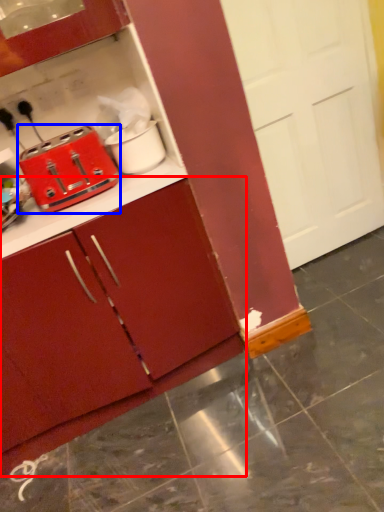
Question: Which object is closer to the camera taking this photo, cabinetry (highlighted by a red box) or toaster (highlighted by a blue box)?

Choices:
 (A) cabinetry
 (B) toaster

Answer: (A)